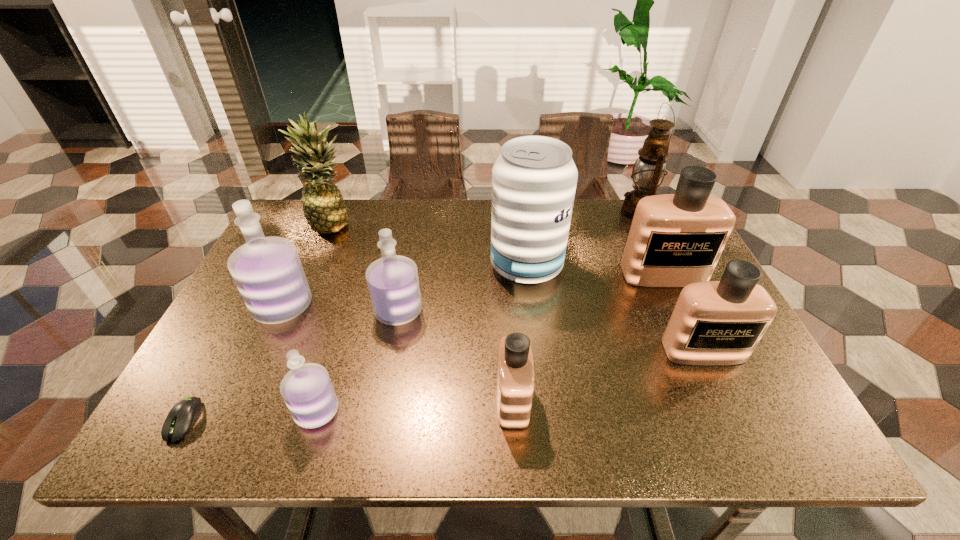
Find the location of a particular element. brown oil lamp is located at coordinates (648, 172).

Find the location of `green pineapple`. green pineapple is located at coordinates (324, 208).

Find the location of a particular element. alcohol is located at coordinates (534, 179).

Where is `the leftmost perfume`? The width and height of the screenshot is (960, 540). the leftmost perfume is located at coordinates (268, 273).

This screenshot has height=540, width=960. I want to click on the leftmost purple perfume, so click(268, 273).

Locate an element on the screen. Image resolution: width=960 pixels, height=540 pixels. the biggest beige perfume is located at coordinates (677, 239).

What are the coordinates of `the second smallest purple perfume` in the screenshot? It's located at (393, 282).

Where is `the rightmost purple perfume`? the rightmost purple perfume is located at coordinates (393, 282).

The image size is (960, 540). What are the coordinates of `the second farthest beige perfume` in the screenshot? It's located at (721, 322).

Where is `the second smallest beige perfume`? This screenshot has width=960, height=540. the second smallest beige perfume is located at coordinates (721, 322).